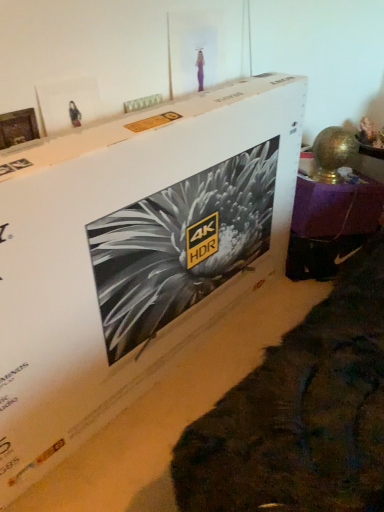
Measure the distance between metallic gold lamp at right and camera.

metallic gold lamp at right and camera are 1.93 meters apart from each other.

In order to face wooden photo frame at upper left, should I rotate leftwards or rightwards?

You should rotate left by 22.274 degrees.

What is the approximate height of white cardboard box at center?

white cardboard box at center is 38.36 inches tall.

Identify the location of metallic gold lamp at right. This screenshot has width=384, height=512. [x=331, y=223].

How much distance is there between white cardboard box at center and wooden photo frame at upper left?

A distance of 23.19 inches exists between white cardboard box at center and wooden photo frame at upper left.

Find the location of a particular element. The width and height of the screenshot is (384, 512). picture frame on the left of the white cardboard box at center is located at coordinates (18, 127).

Considering the relative sizes of white cardboard box at center and wooden photo frame at upper left in the image provided, is white cardboard box at center thinner than wooden photo frame at upper left?

In fact, white cardboard box at center might be wider than wooden photo frame at upper left.

From a real-world perspective, relative to wooden photo frame at upper left, is white cardboard box at center vertically above or below?

white cardboard box at center is below wooden photo frame at upper left.

From the picture: Are wooden photo frame at upper left and metallic gold lamp at right far apart?

Absolutely, wooden photo frame at upper left is distant from metallic gold lamp at right.

Considering the positions of objects wooden photo frame at upper left and metallic gold lamp at right in the image provided, who is in front, wooden photo frame at upper left or metallic gold lamp at right?

wooden photo frame at upper left is closer to the camera.

Does wooden photo frame at upper left have a larger size compared to metallic gold lamp at right?

Actually, wooden photo frame at upper left might be smaller than metallic gold lamp at right.

What's the angular difference between wooden photo frame at upper left and metallic gold lamp at right's facing directions?

There is a 34.8-degree angle between the facing directions of wooden photo frame at upper left and metallic gold lamp at right.

Is point (31, 117) positioned in front of point (13, 371)?

No.

In the image, is wooden photo frame at upper left on the left side or the right side of white cardboard box at center?

In the image, wooden photo frame at upper left appears on the left side of white cardboard box at center.

Is wooden photo frame at upper left positioned with its back to white cardboard box at center?

wooden photo frame at upper left does not have its back to white cardboard box at center.

Would you say wooden photo frame at upper left is a long distance from white cardboard box at center?

wooden photo frame at upper left is near white cardboard box at center, not far away.

From the picture: Which object is thinner, metallic gold lamp at right or white cardboard box at center?

white cardboard box at center.

From the image's perspective, between metallic gold lamp at right and white cardboard box at center, who is located below?

white cardboard box at center appears lower in the image.

Based on their sizes in the image, would you say metallic gold lamp at right is bigger or smaller than white cardboard box at center?

Considering their sizes, metallic gold lamp at right takes up less space than white cardboard box at center.

Does metallic gold lamp at right lie behind wooden photo frame at upper left?

Yes, it is.

Can you confirm if metallic gold lamp at right is bigger than wooden photo frame at upper left?

Yes, metallic gold lamp at right is bigger than wooden photo frame at upper left.

Measure the distance between metallic gold lamp at right and wooden photo frame at upper left.

1.37 meters.

Considering the relative sizes of metallic gold lamp at right and wooden photo frame at upper left in the image provided, is metallic gold lamp at right taller than wooden photo frame at upper left?

Indeed, metallic gold lamp at right has a greater height compared to wooden photo frame at upper left.

Which of these two, white cardboard box at center or metallic gold lamp at right, is bigger?

white cardboard box at center is bigger.

Considering the positions of objects white cardboard box at center and metallic gold lamp at right in the image provided, who is more to the right, white cardboard box at center or metallic gold lamp at right?

metallic gold lamp at right.

Which object is wider, white cardboard box at center or metallic gold lamp at right?

metallic gold lamp at right.

Can you see white cardboard box at center touching metallic gold lamp at right?

No, white cardboard box at center is not with metallic gold lamp at right.

The height and width of the screenshot is (512, 384). I want to click on picture frame lying on the left of white cardboard box at center, so click(x=18, y=127).

Locate an element on the screen. Image resolution: width=384 pixels, height=512 pixels. furniture lying on the right of wooden photo frame at upper left is located at coordinates (331, 223).

When comparing their distances from metallic gold lamp at right, does wooden photo frame at upper left or white cardboard box at center seem closer?

Based on the image, white cardboard box at center appears to be nearer to metallic gold lamp at right.

Looking at the image, which one is located further to wooden photo frame at upper left, metallic gold lamp at right or white cardboard box at center?

The object further to wooden photo frame at upper left is metallic gold lamp at right.

From the image, which object appears to be farther from white cardboard box at center, wooden photo frame at upper left or metallic gold lamp at right?

Among the two, metallic gold lamp at right is located further to white cardboard box at center.

Based on their spatial positions, is metallic gold lamp at right or wooden photo frame at upper left further from white cardboard box at center?

The object further to white cardboard box at center is metallic gold lamp at right.

From the picture: From the image, which object appears to be nearer to wooden photo frame at upper left, white cardboard box at center or metallic gold lamp at right?

white cardboard box at center.

From the image, which object appears to be farther from metallic gold lamp at right, white cardboard box at center or wooden photo frame at upper left?

Based on the image, wooden photo frame at upper left appears to be further to metallic gold lamp at right.

Image resolution: width=384 pixels, height=512 pixels. Identify the location of picture frame between white cardboard box at center and metallic gold lamp at right along the z-axis. 18,127.